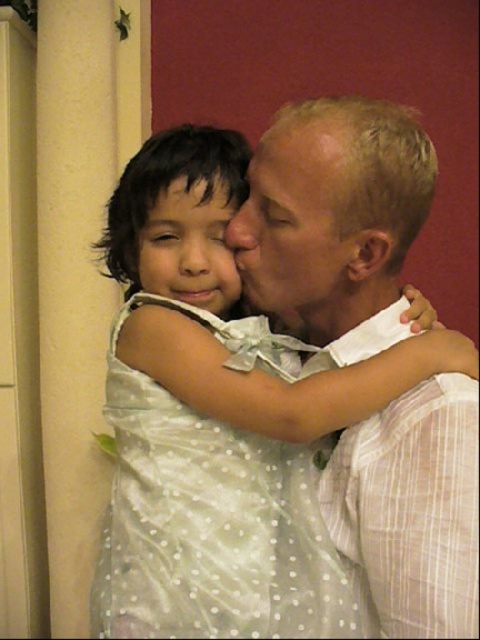
What is the object located at coordinates point (219, 417)?

The point (219, 417) corresponds to the white dotted dress at center.

You are a photographer standing at a distance of 30 inches from the subject. You want to capture a closeup shot of the smooth skin face at center. Is the current distance sufficient for a clear closeup?

The smooth skin face at center is 29.78 inches away from the viewer, which is within the 30 inches distance you are standing. Therefore, the current distance is sufficient for a clear closeup.